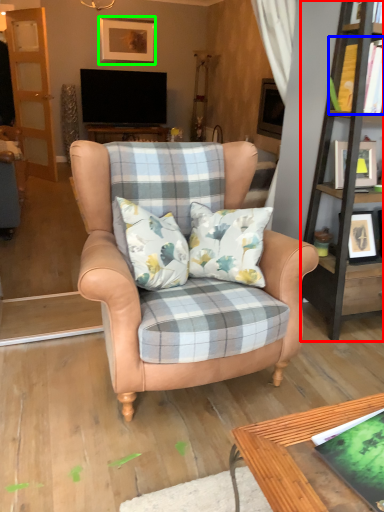
Question: Which object is positioned closest to bookshelf (highlighted by a red box)? Select from book (highlighted by a blue box) and picture frame (highlighted by a green box).

Choices:
 (A) book
 (B) picture frame

Answer: (A)